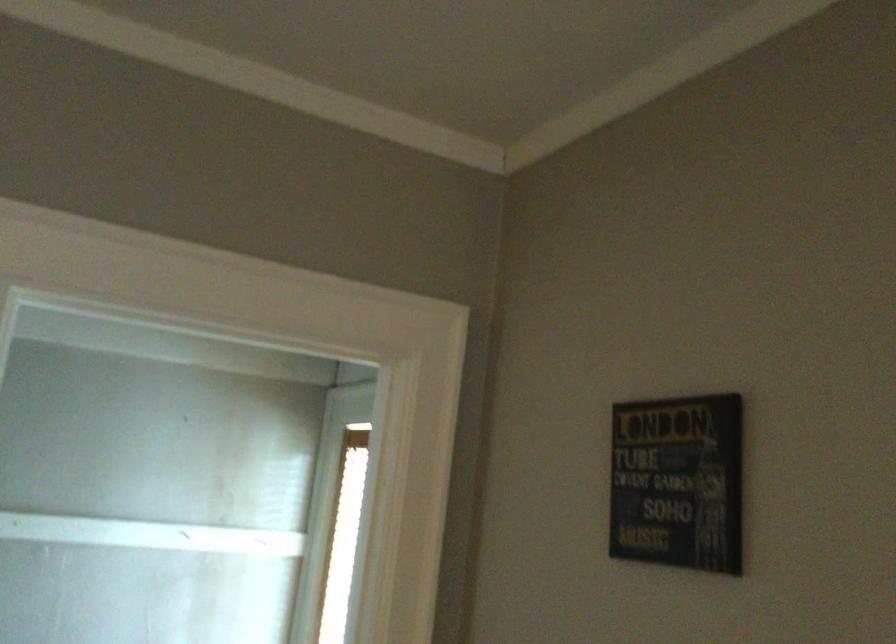
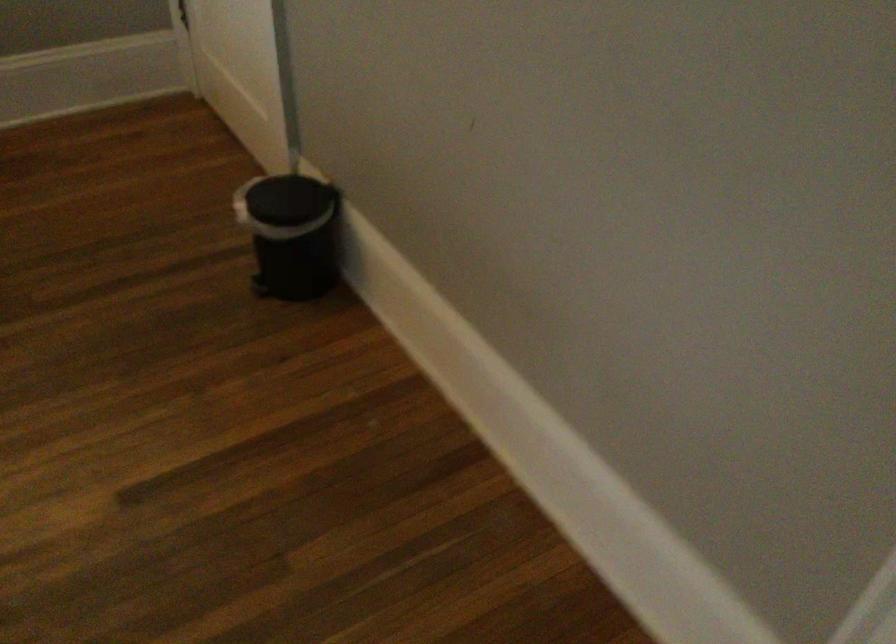
First-person continuous shooting, in which direction is the camera rotating?

The camera's rotation is toward left-down.